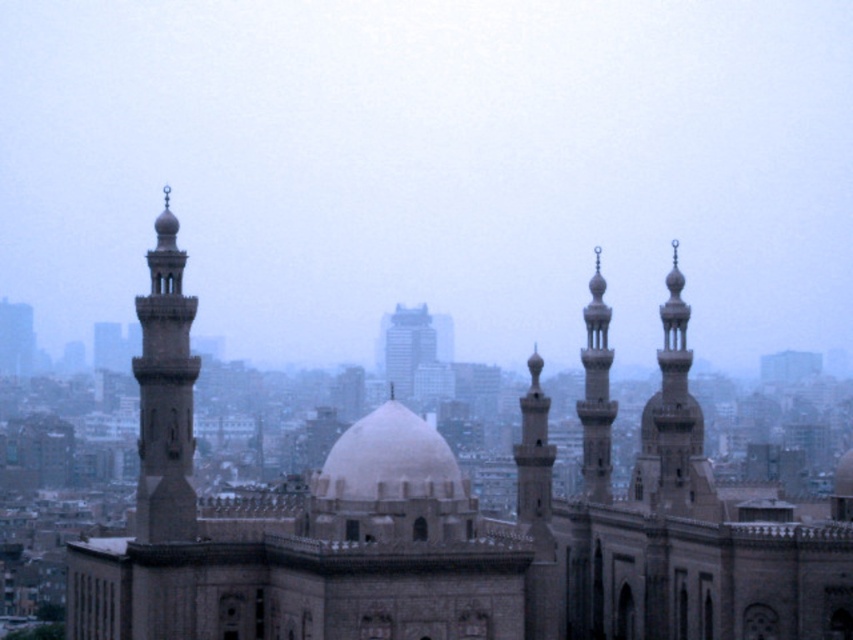
In the scene shown: Which is more to the left, smooth stone minaret at upper right or white glass skyscraper at center?

From the viewer's perspective, white glass skyscraper at center appears more on the left side.

The height and width of the screenshot is (640, 853). What are the coordinates of `smooth stone minaret at upper right` in the screenshot? It's located at (672, 422).

Is gray stone minaret at left to the right of smooth stone minaret at center from the viewer's perspective?

No, gray stone minaret at left is not to the right of smooth stone minaret at center.

I want to click on gray stone minaret at left, so click(165, 394).

Find the location of a particular element. gray stone minaret at left is located at coordinates (165, 394).

Is point (405, 477) positioned after point (404, 372)?

No, it is not.

Which of these two, white stone dome at center or white glass skyscraper at center, stands shorter?

With less height is white stone dome at center.

Is point (338, 486) farther from camera compared to point (392, 316)?

No, it is in front of (392, 316).

Locate an element on the screen. This screenshot has width=853, height=640. white stone dome at center is located at coordinates [390, 461].